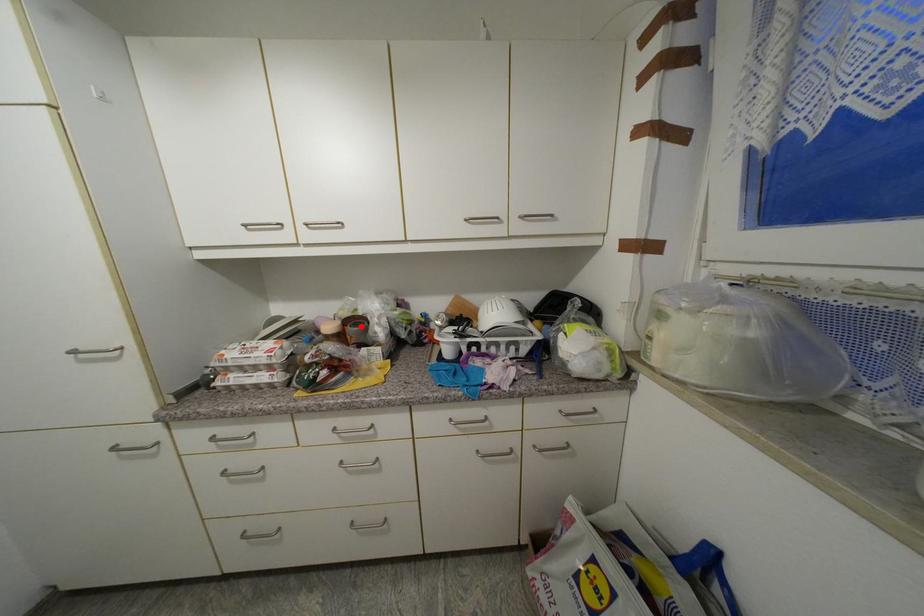
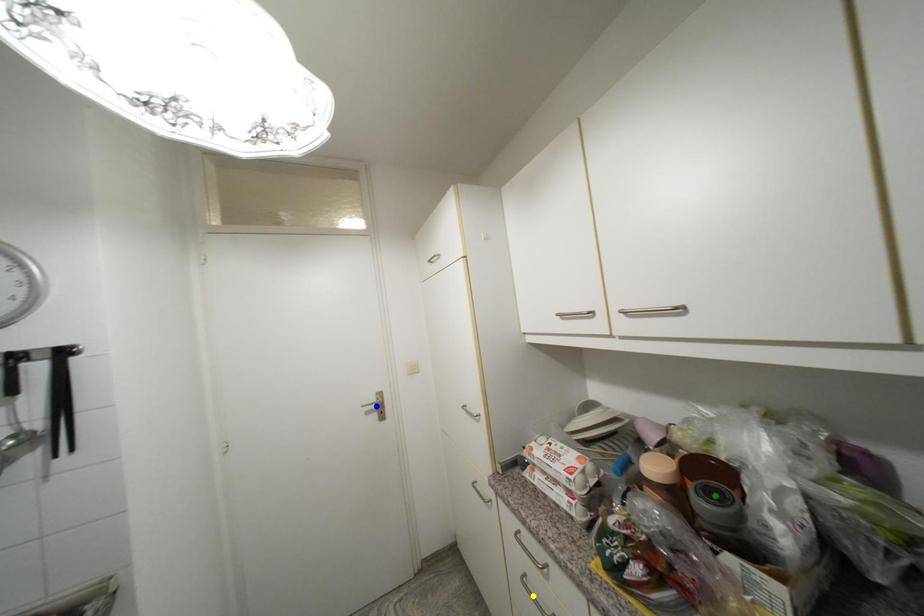
Question: I am providing you with two images of the same scene from different viewpoints. A red point is marked on the first image. You are given multiple points on the second image. Which point in image 2 represents the same 3d spot as the red point in image 1?

Choices:
 (A) yellow point
 (B) green point
 (C) blue point

Answer: (B)